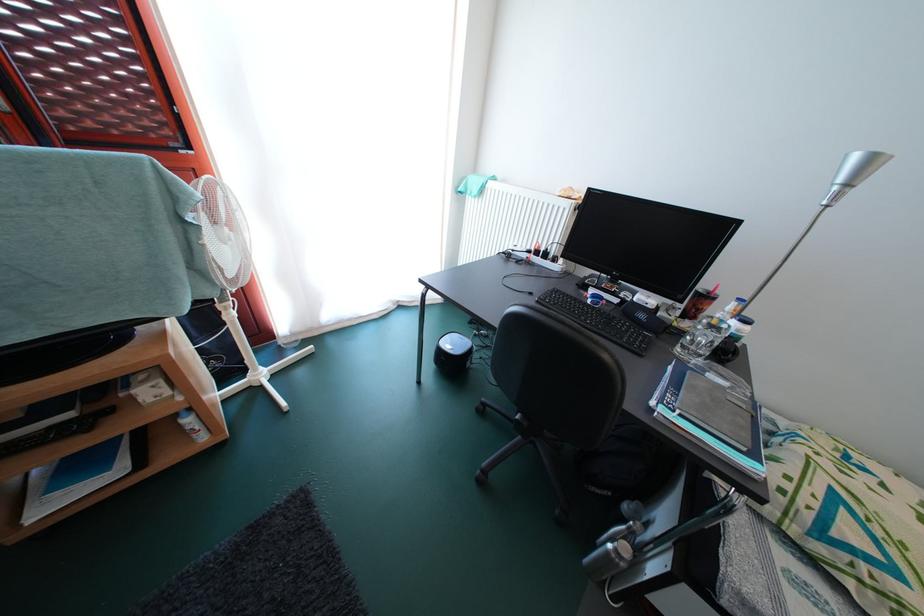
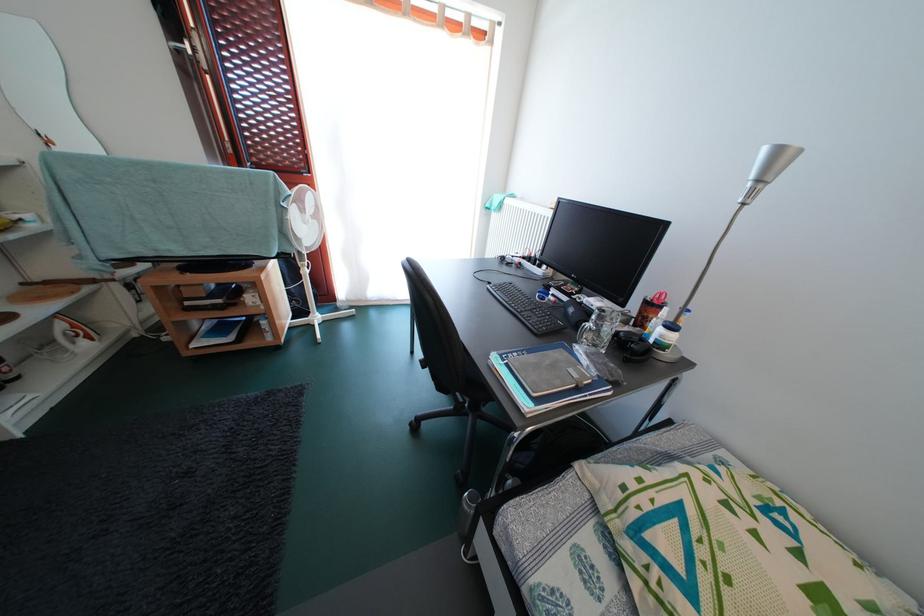
Find the pixel in the second image that matches (710,361) in the first image.

(602, 351)